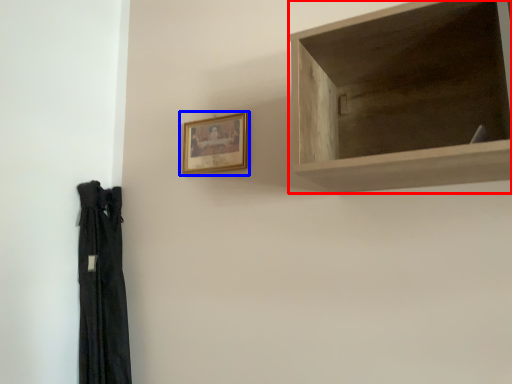
Question: Which point is closer to the camera, shelf (highlighted by a red box) or picture frame (highlighted by a blue box)?

Choices:
 (A) shelf
 (B) picture frame

Answer: (A)